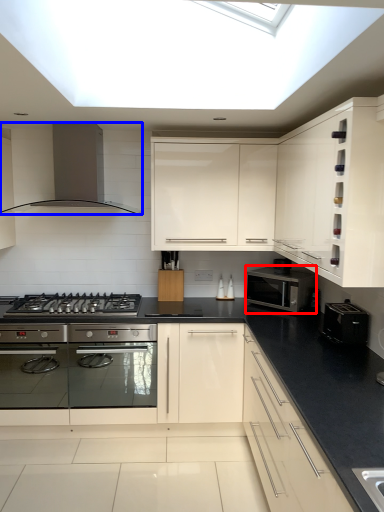
Question: Which object is further to the camera taking this photo, microwave oven (highlighted by a red box) or home appliance (highlighted by a blue box)?

Choices:
 (A) microwave oven
 (B) home appliance

Answer: (A)